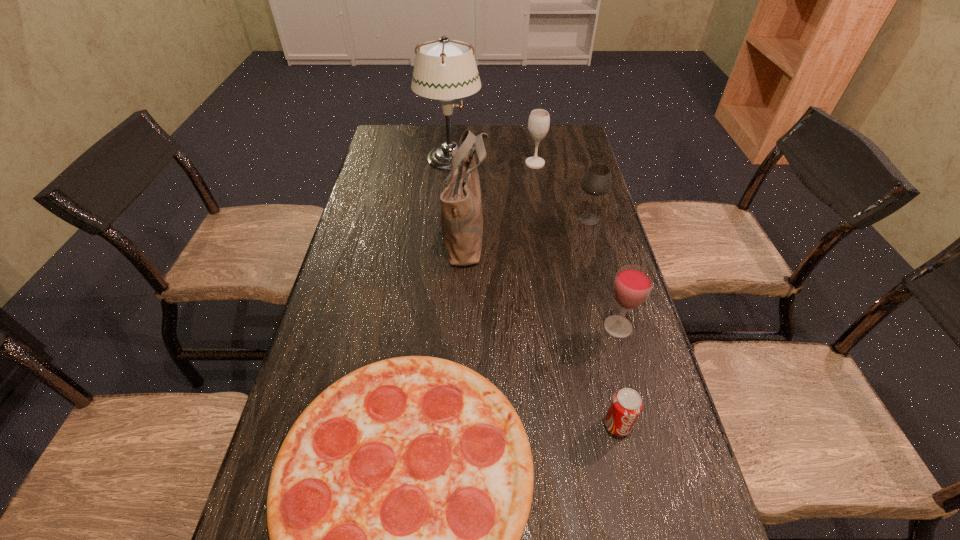
Find the location of a particular element. The image size is (960, 540). blank region between the nearest wineglass and the farthest wineglass is located at coordinates (576, 245).

At what (x,y) coordinates should I click in order to perform the action: click on vacant area that lies between the second nearest wineglass and the third nearest object. Please return your answer as a coordinate pair (x, y). This screenshot has height=540, width=960. Looking at the image, I should click on (603, 273).

Locate an element on the screen. The width and height of the screenshot is (960, 540). free space between the second nearest wineglass and the leftmost wineglass is located at coordinates click(x=562, y=191).

Find the location of a particular element. blank region between the shoulder bag and the second nearest wineglass is located at coordinates (527, 227).

Locate an element on the screen. free area in between the shoulder bag and the second farthest wineglass is located at coordinates (527, 227).

Identify the location of free space between the second farthest wineglass and the soda can. Image resolution: width=960 pixels, height=540 pixels. (603, 322).

You are a GUI agent. You are given a task and a screenshot of the screen. Output one action in this format:
    pyautogui.click(x=<x>, y=<y>)
    Task: Click on the unoccupied area between the shoulder bag and the soda can
    This screenshot has width=960, height=540.
    Given the screenshot: What is the action you would take?
    pyautogui.click(x=541, y=329)

Locate an element on the screen. The image size is (960, 540). object identified as the sixth closest to the fifth farthest object is located at coordinates 444,69.

At what (x,y) coordinates should I click in order to perform the action: click on the second closest object relative to the lampshade. Please return your answer as a coordinate pair (x, y). The width and height of the screenshot is (960, 540). Looking at the image, I should click on (461, 207).

At what (x,y) coordinates should I click in order to perform the action: click on wineglass that can be found as the second closest to the fifth farthest object. Please return your answer as a coordinate pair (x, y). Looking at the image, I should click on (539, 120).